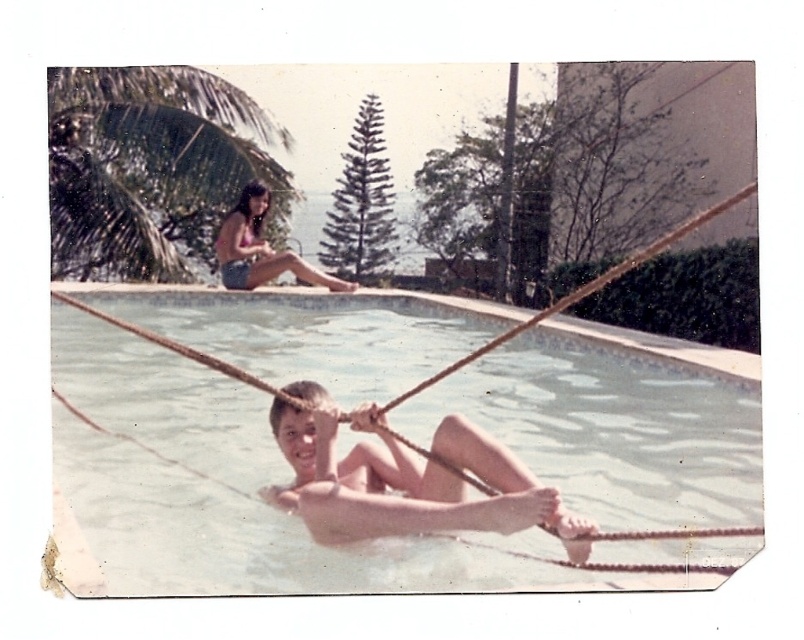
You are standing at the edge of the pool and want to throw a ball to a friend. You have two points to choose from in the pool area marked as point (761, 504) and point (238, 275). Which point is closer to you so that you can throw the ball accurately?

Point (761, 504) is closer to the viewer than point (238, 275), so you should aim for point (761, 504) to throw the ball accurately.

You are a photographer trying to capture the entire scene of the clear plastic water at center and the green leafy palm tree at upper left in one shot. Based on their heights, which object should you focus on first to ensure both are in frame?

The clear plastic water at center is shorter than the green leafy palm tree at upper left, so you should focus on the green leafy palm tree at upper left first to ensure both are in frame.

You are a photographer standing at the edge of the pool. You want to take a photo that includes both the green leafy palm tree at upper left and the smooth skin child at center. The camera you are using has a maximum zoom range that can capture objects up to 10 meters apart. Will you be able to capture both subjects in a single frame without moving the camera?

The green leafy palm tree at upper left and smooth skin child at center are 10.62 meters apart from each other. Since the camera can only capture up to 10 meters, the distance between them exceeds the maximum zoom range. Therefore, you won